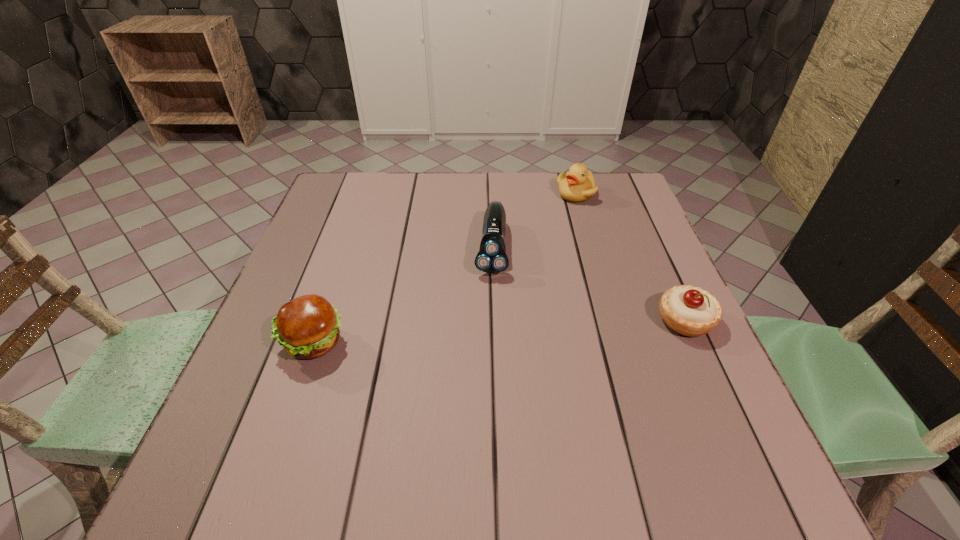
In the image, there is a desktop. Find the location of `free space at the near edge`. free space at the near edge is located at coordinates [492, 413].

Image resolution: width=960 pixels, height=540 pixels. Find the location of `free space at the left edge of the desktop`. free space at the left edge of the desktop is located at coordinates (298, 277).

This screenshot has height=540, width=960. In the image, there is a desktop. Find the location of `free region at the right edge`. free region at the right edge is located at coordinates (613, 246).

The image size is (960, 540). What are the coordinates of `free space at the far left corner of the desktop` in the screenshot? It's located at (342, 190).

Image resolution: width=960 pixels, height=540 pixels. I want to click on free space at the far right corner, so click(620, 186).

The width and height of the screenshot is (960, 540). In order to click on free area in between the pastry and the third object from left to right in this screenshot , I will do `click(631, 257)`.

Where is `vacant area that lies between the second object from right to left and the rightmost object`? The width and height of the screenshot is (960, 540). vacant area that lies between the second object from right to left and the rightmost object is located at coordinates (631, 257).

At what (x,y) coordinates should I click in order to perform the action: click on free space between the rightmost object and the second farthest object. Please return your answer as a coordinate pair (x, y). The height and width of the screenshot is (540, 960). Looking at the image, I should click on (588, 284).

Identify the location of vacant space that's between the second farthest object and the pastry. The width and height of the screenshot is (960, 540). (588, 284).

The height and width of the screenshot is (540, 960). Find the location of `free space between the duckling and the rightmost object`. free space between the duckling and the rightmost object is located at coordinates point(631,257).